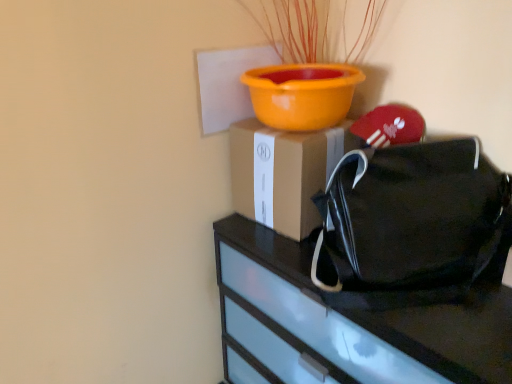
Question: Is black fabric handbag at right further to the viewer compared to black matte bag at right?

Choices:
 (A) yes
 (B) no

Answer: (A)

Question: Does black fabric handbag at right have a greater width compared to black matte bag at right?

Choices:
 (A) no
 (B) yes

Answer: (A)

Question: Does black fabric handbag at right have a larger size compared to black matte bag at right?

Choices:
 (A) no
 (B) yes

Answer: (A)

Question: Is black fabric handbag at right shorter than black matte bag at right?

Choices:
 (A) no
 (B) yes

Answer: (B)

Question: Could you tell me if black fabric handbag at right is facing black matte bag at right?

Choices:
 (A) yes
 (B) no

Answer: (B)

Question: Is black fabric handbag at right far away from black matte bag at right?

Choices:
 (A) yes
 (B) no

Answer: (B)

Question: Does black matte bag at right have a greater height compared to brown cardboard box at center?

Choices:
 (A) no
 (B) yes

Answer: (B)

Question: Is black matte bag at right positioned with its back to brown cardboard box at center?

Choices:
 (A) no
 (B) yes

Answer: (A)

Question: Is there a large distance between black matte bag at right and brown cardboard box at center?

Choices:
 (A) yes
 (B) no

Answer: (B)

Question: Is black matte bag at right directly adjacent to brown cardboard box at center?

Choices:
 (A) no
 (B) yes

Answer: (A)

Question: Is black matte bag at right at the left side of brown cardboard box at center?

Choices:
 (A) yes
 (B) no

Answer: (B)

Question: Is black matte bag at right at the right side of brown cardboard box at center?

Choices:
 (A) yes
 (B) no

Answer: (A)

Question: Is brown cardboard box at center next to black fabric handbag at right and touching it?

Choices:
 (A) no
 (B) yes

Answer: (A)